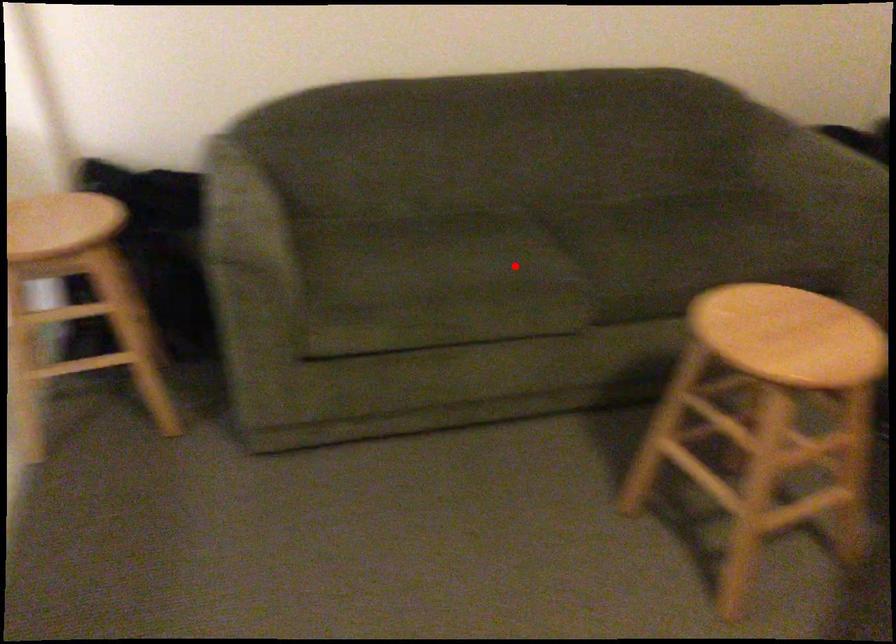
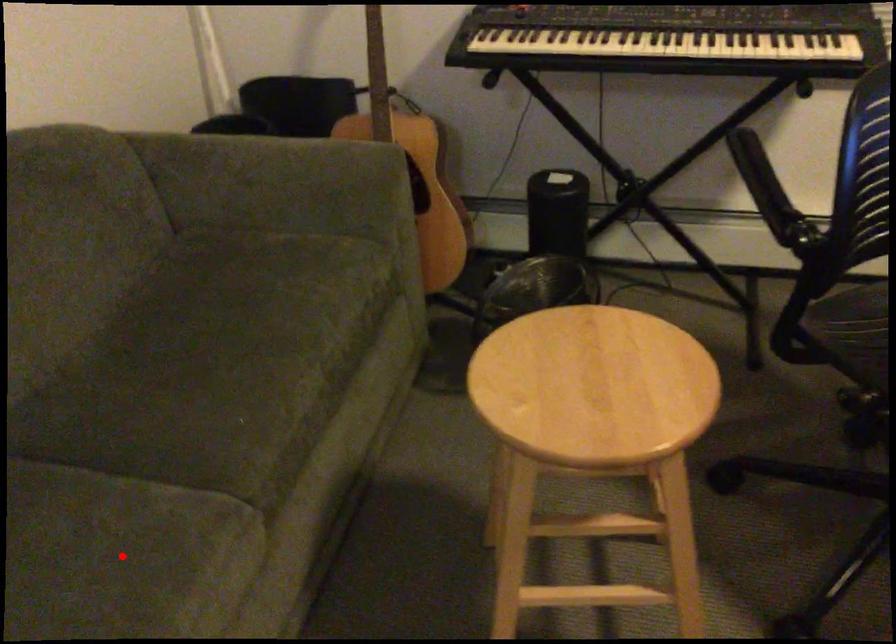
I am providing you with two images of the same scene from different viewpoints. A red point is marked on the first image and another point is marked on the second image. Is the marked point in image1 the same physical position as the marked point in image2?

Yes